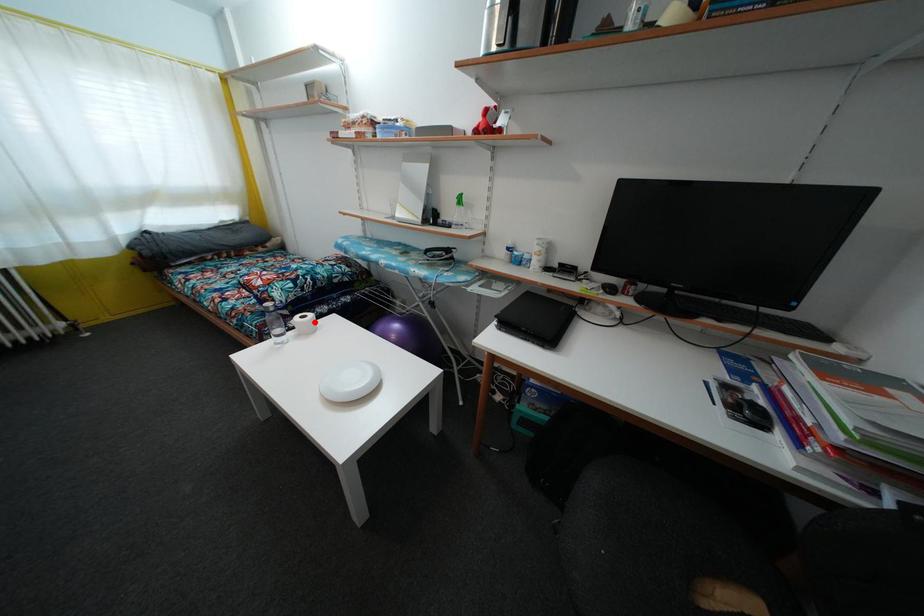
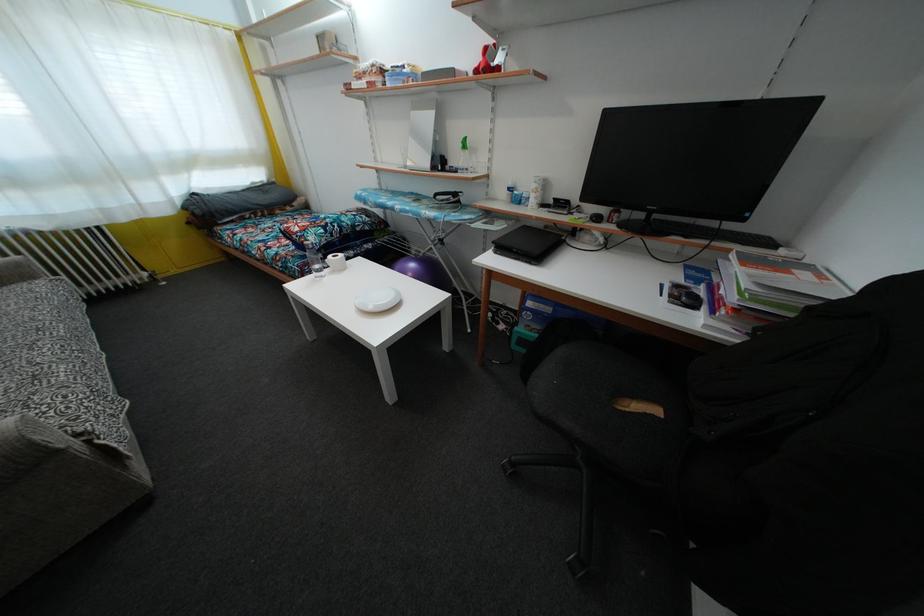
Find the pixel in the second image that matches the highlighted location in the first image.

(345, 262)